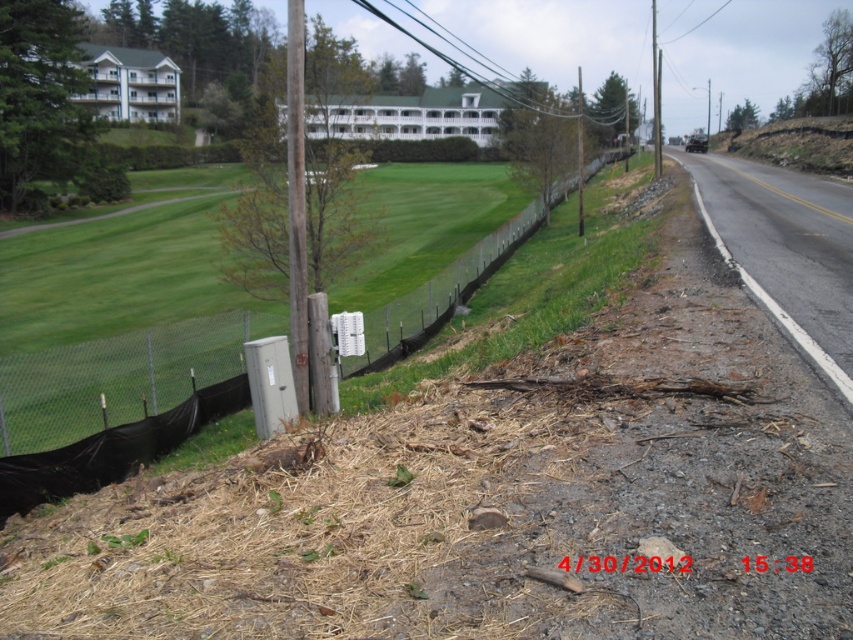
Question: Is the position of black mesh fence at center more distant than that of brown wood pole at center?

Choices:
 (A) yes
 (B) no

Answer: (B)

Question: Which object appears farthest from the camera in this image?

Choices:
 (A) black mesh fence at center
 (B) smooth wooden post at center

Answer: (B)

Question: Observing the image, what is the correct spatial positioning of brown wood pole at center in reference to smooth wooden post at center?

Choices:
 (A) left
 (B) right

Answer: (A)

Question: Is black mesh fence at center wider than brown wood pole at center?

Choices:
 (A) yes
 (B) no

Answer: (A)

Question: Which is farther from the brown wood pole at center?

Choices:
 (A) smooth wooden post at center
 (B) black mesh fence at center

Answer: (A)

Question: Among these points, which one is nearest to the camera?

Choices:
 (A) (7, 506)
 (B) (303, 193)

Answer: (A)